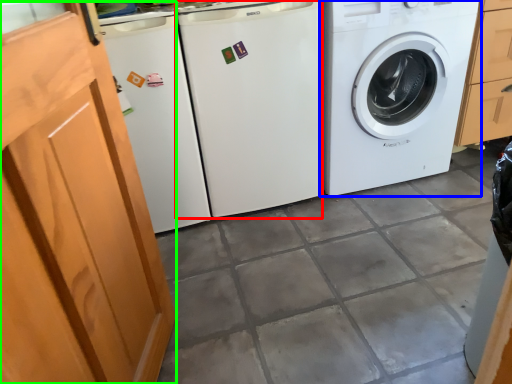
Question: Estimate the real-world distances between objects in this image. Which object is closer to washing machine (highlighted by a red box), washing machine (highlighted by a blue box) or screen door (highlighted by a green box)?

Choices:
 (A) washing machine
 (B) screen door

Answer: (A)